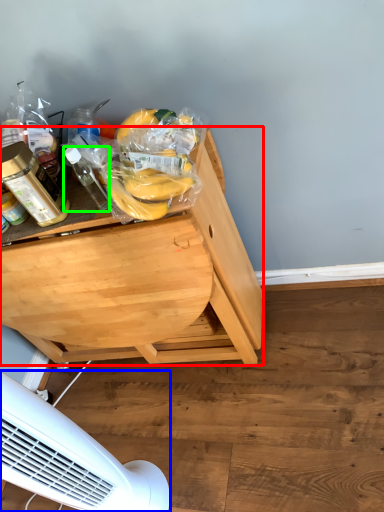
Question: Based on their relative distances, which object is nearer to desk (highlighted by a red box)? Choose from mechanical fan (highlighted by a blue box) and bottle (highlighted by a green box).

Choices:
 (A) mechanical fan
 (B) bottle

Answer: (B)